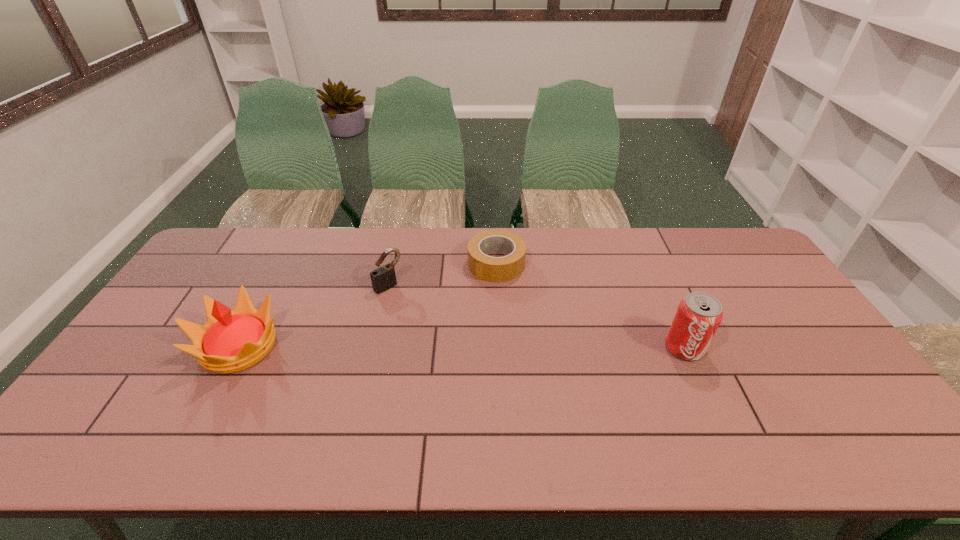
The height and width of the screenshot is (540, 960). What are the coordinates of `crown` in the screenshot? It's located at (231, 341).

This screenshot has width=960, height=540. Identify the location of soda can. (699, 314).

Identify the location of the second object from left to right. (383, 278).

You are a GUI agent. You are given a task and a screenshot of the screen. Output one action in this format:
    pyautogui.click(x=<x>, y=<y>)
    Task: Click on the second shortest object
    Image resolution: width=960 pixels, height=540 pixels.
    Given the screenshot: What is the action you would take?
    pyautogui.click(x=383, y=278)

Locate an element on the screen. The height and width of the screenshot is (540, 960). the second object from right to left is located at coordinates (493, 269).

This screenshot has height=540, width=960. In order to click on the shortest object in this screenshot , I will do `click(493, 269)`.

Locate an element on the screen. The image size is (960, 540). vacant space positioned 0.220m on the back of the leftmost object is located at coordinates (281, 267).

Where is `free spot located 0.220m on the left of the soda can`? The height and width of the screenshot is (540, 960). free spot located 0.220m on the left of the soda can is located at coordinates (586, 348).

Find the location of a particular element. vacant space located 0.070m with the keyhole on the front of the padlock is located at coordinates (409, 304).

Where is `vacant point located 0.170m with the keyhole on the front of the padlock`? This screenshot has width=960, height=540. vacant point located 0.170m with the keyhole on the front of the padlock is located at coordinates (428, 322).